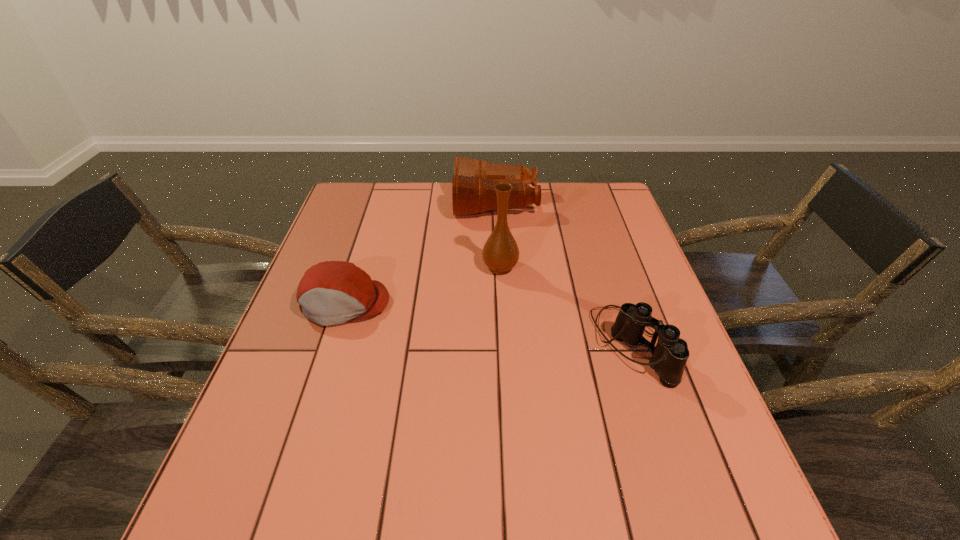
Locate an element on the screen. This screenshot has width=960, height=540. free space in the image that satisfies the following two spatial constraints: 1. through the lenses of the rightmost object; 2. on the left side of the farthest object is located at coordinates (503, 346).